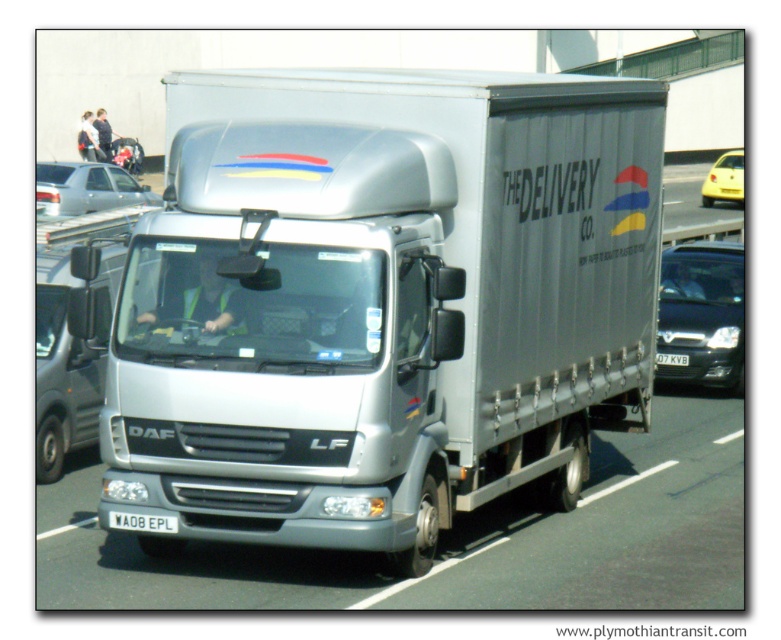
Question: Estimate the real-world distances between objects in this image. Which object is closer to the yellow plastic car at right?

Choices:
 (A) silver metallic trailer truck at center
 (B) whiteplasticlicense plate at center

Answer: (A)

Question: Is yellow plastic car at right above silver metallic sedan at left?

Choices:
 (A) no
 (B) yes

Answer: (B)

Question: Which object appears farthest from the camera in this image?

Choices:
 (A) silver metallic trailer truck at center
 (B) silver metallic sedan at left

Answer: (B)

Question: Among these points, which one is nearest to the camera?

Choices:
 (A) (710, 198)
 (B) (737, 202)
 (C) (673, 356)

Answer: (C)

Question: Is the position of silver metallic sedan at left more distant than that of yellow matte taxi at right?

Choices:
 (A) yes
 (B) no

Answer: (B)

Question: Is yellow plastic car at right to the left of white plastic license plate at center from the viewer's perspective?

Choices:
 (A) no
 (B) yes

Answer: (A)